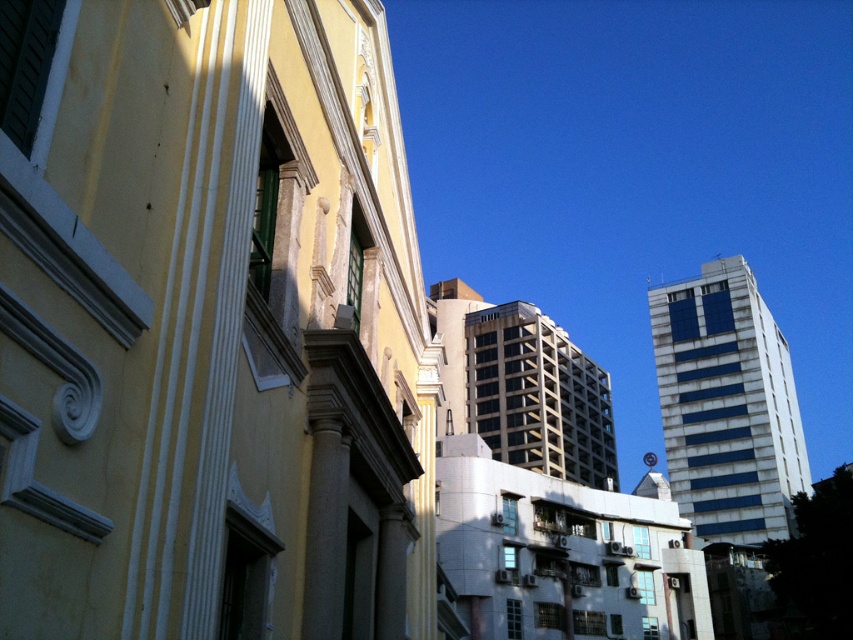
Question: Which point is closer to the camera?

Choices:
 (A) (512, 321)
 (B) (759, 518)

Answer: (B)

Question: Considering the relative positions of blue glass building at upper right and beige concrete building at center in the image provided, where is blue glass building at upper right located with respect to beige concrete building at center?

Choices:
 (A) above
 (B) below

Answer: (A)

Question: Which point is closer to the camera?

Choices:
 (A) beige concrete building at center
 (B) blue glass building at upper right

Answer: (A)

Question: Is blue glass building at upper right bigger than beige concrete building at center?

Choices:
 (A) no
 (B) yes

Answer: (A)

Question: Among these objects, which one is farthest from the camera?

Choices:
 (A) beige concrete building at center
 (B) blue glass building at upper right

Answer: (B)

Question: Is blue glass building at upper right smaller than beige concrete building at center?

Choices:
 (A) no
 (B) yes

Answer: (B)